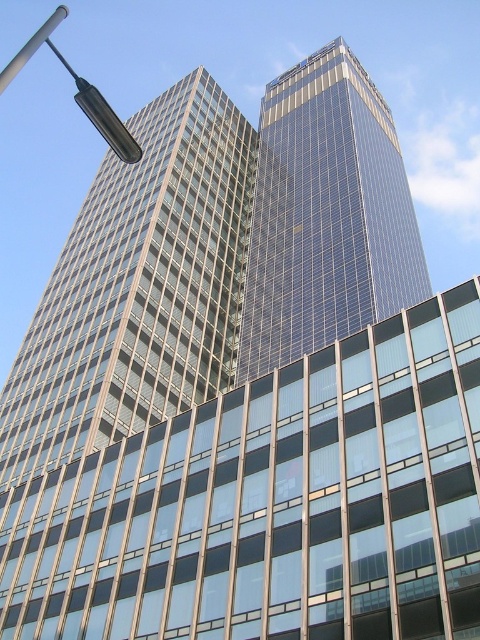
Question: Which point is closer to the camera taking this photo?

Choices:
 (A) (56, 12)
 (B) (348, 305)
 (C) (61, 4)

Answer: (B)

Question: Is glassy reflective skyscraper at center closer to camera compared to black glass lamp post at upper left?

Choices:
 (A) yes
 (B) no

Answer: (B)

Question: Does black glass lamp post at upper left appear under metallic pole at upper left?

Choices:
 (A) yes
 (B) no

Answer: (A)

Question: Considering the relative positions of glassy reflective skyscraper at center and metallic pole at upper left in the image provided, where is glassy reflective skyscraper at center located with respect to metallic pole at upper left?

Choices:
 (A) above
 (B) below

Answer: (B)

Question: Which point is farther from the camera taking this photo?

Choices:
 (A) (382, 176)
 (B) (33, 42)
 (C) (84, 113)

Answer: (B)

Question: Which is farther from the metallic pole at upper left?

Choices:
 (A) black glass lamp post at upper left
 (B) glassy reflective skyscraper at center

Answer: (B)